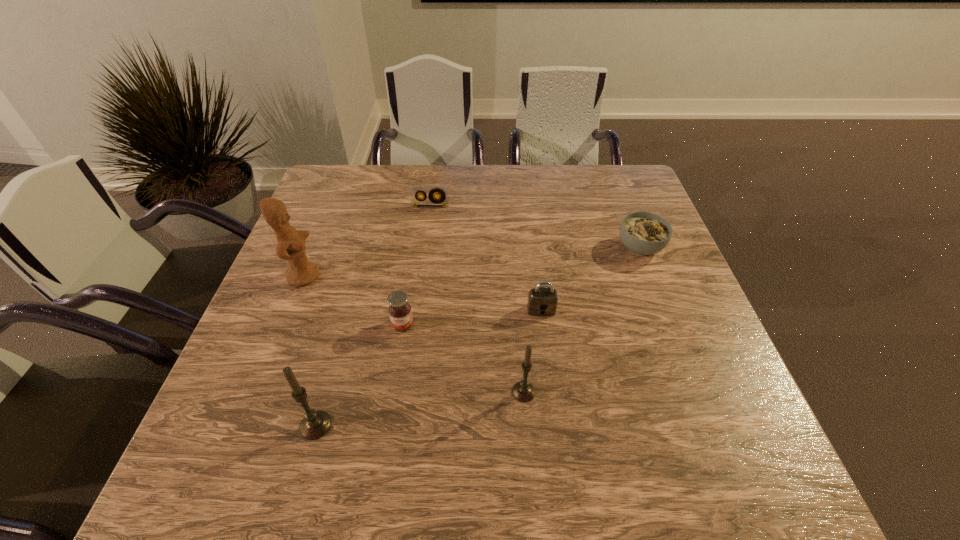
In order to click on vacant space located 0.150m on the left of the taller candle in this screenshot , I will do `click(220, 426)`.

Find the location of a particular element. The height and width of the screenshot is (540, 960). free space located on the back of the fifth object from left to right is located at coordinates (513, 250).

The height and width of the screenshot is (540, 960). Find the location of `vacant space located on the front of the soup bowl`. vacant space located on the front of the soup bowl is located at coordinates pyautogui.click(x=667, y=318).

Locate an element on the screen. Image resolution: width=960 pixels, height=540 pixels. vacant space located at the front of the videotape with visible reels is located at coordinates (420, 280).

The width and height of the screenshot is (960, 540). What are the coordinates of `vacant area located 0.210m on the front-facing side of the figurine` in the screenshot? It's located at (404, 275).

Locate an element on the screen. This screenshot has width=960, height=540. vacant area situated 0.220m on the label side of the jam is located at coordinates (387, 428).

Locate an element on the screen. free space located 0.100m at the front of the sixth object from left to right near the keyhole is located at coordinates (547, 353).

Locate an element on the screen. The width and height of the screenshot is (960, 540). object situated at the far edge is located at coordinates (415, 191).

This screenshot has height=540, width=960. What are the coordinates of `object present at the left edge` in the screenshot? It's located at (290, 246).

Identify the location of object that is positioned at the right edge. (643, 233).